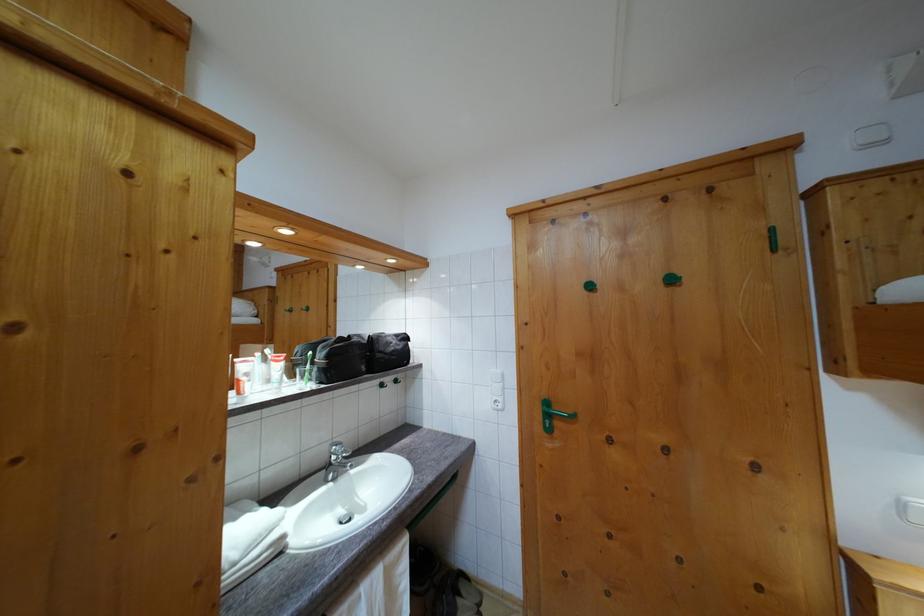
Locate an element on the screen. Image resolution: width=924 pixels, height=616 pixels. green door knob is located at coordinates (548, 426).